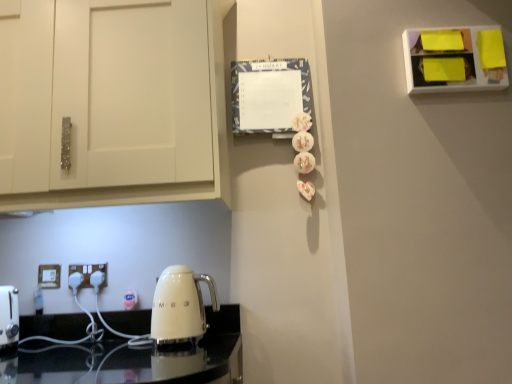
How much space does white plastic electric outlet at lower left, the 2th electric outlet in the left-to-right sequence, occupy horizontally?

2.17 centimeters.

Describe the element at coordinates (90, 273) in the screenshot. I see `white plastic electric outlet at lower left, placed as the 1th electric outlet when sorted from right to left` at that location.

Locate an element on the screen. This screenshot has width=512, height=384. white plastic electric outlet at lower left, placed as the 1th electric outlet when sorted from right to left is located at coordinates (90, 273).

What is the approximate width of white plastic electric outlet at lower left, the 2th electric outlet viewed from the right?

white plastic electric outlet at lower left, the 2th electric outlet viewed from the right, is 1.94 centimeters in width.

The width and height of the screenshot is (512, 384). What do you see at coordinates (49, 276) in the screenshot? I see `white plastic electric outlet at lower left, marked as the first electric outlet in a left-to-right arrangement` at bounding box center [49, 276].

Locate an element on the screen. This screenshot has width=512, height=384. white plastic electric outlet at lower left, marked as the first electric outlet in a left-to-right arrangement is located at coordinates (49, 276).

The height and width of the screenshot is (384, 512). Identify the location of white plastic electric outlet at lower left, placed as the 1th electric outlet when sorted from right to left. (90, 273).

Is white plastic electric outlet at lower left, placed as the 1th electric outlet when sorted from right to left, at the right side of white plastic electric outlet at lower left, the 2th electric outlet viewed from the right?

Indeed, white plastic electric outlet at lower left, placed as the 1th electric outlet when sorted from right to left, is positioned on the right side of white plastic electric outlet at lower left, the 2th electric outlet viewed from the right.

Is the depth of white plastic electric outlet at lower left, placed as the 1th electric outlet when sorted from right to left, less than that of white plastic electric outlet at lower left, marked as the first electric outlet in a left-to-right arrangement?

Yes, white plastic electric outlet at lower left, placed as the 1th electric outlet when sorted from right to left, is in front of white plastic electric outlet at lower left, marked as the first electric outlet in a left-to-right arrangement.

Which is less distant, (92, 265) or (56, 282)?

Point (92, 265) is farther from the camera than point (56, 282).

From the image's perspective, which one is positioned higher, white plastic electric outlet at lower left, placed as the 1th electric outlet when sorted from right to left, or white plastic electric outlet at lower left, the 2th electric outlet viewed from the right?

white plastic electric outlet at lower left, placed as the 1th electric outlet when sorted from right to left, from the image's perspective.

From a real-world perspective, who is located higher, white plastic electric outlet at lower left, placed as the 1th electric outlet when sorted from right to left, or white plastic electric outlet at lower left, marked as the first electric outlet in a left-to-right arrangement?

white plastic electric outlet at lower left, placed as the 1th electric outlet when sorted from right to left.

Looking at this image, considering the relative sizes of white plastic electric outlet at lower left, placed as the 1th electric outlet when sorted from right to left, and white plastic electric outlet at lower left, the 2th electric outlet viewed from the right, in the image provided, is white plastic electric outlet at lower left, placed as the 1th electric outlet when sorted from right to left, wider than white plastic electric outlet at lower left, the 2th electric outlet viewed from the right,?

Yes.

Who is taller, white plastic electric outlet at lower left, placed as the 1th electric outlet when sorted from right to left, or white plastic electric outlet at lower left, the 2th electric outlet viewed from the right?

Standing taller between the two is white plastic electric outlet at lower left, the 2th electric outlet viewed from the right.

Is white plastic electric outlet at lower left, the 2th electric outlet in the left-to-right sequence, bigger or smaller than white plastic electric outlet at lower left, marked as the first electric outlet in a left-to-right arrangement?

In the image, white plastic electric outlet at lower left, the 2th electric outlet in the left-to-right sequence, appears to be larger than white plastic electric outlet at lower left, marked as the first electric outlet in a left-to-right arrangement.

Would you say white plastic electric outlet at lower left, the 2th electric outlet in the left-to-right sequence, contains white plastic electric outlet at lower left, the 2th electric outlet viewed from the right?

No, white plastic electric outlet at lower left, the 2th electric outlet viewed from the right, is not inside white plastic electric outlet at lower left, the 2th electric outlet in the left-to-right sequence.

Are white plastic electric outlet at lower left, the 2th electric outlet in the left-to-right sequence, and white plastic electric outlet at lower left, marked as the first electric outlet in a left-to-right arrangement, located far from each other?

white plastic electric outlet at lower left, the 2th electric outlet in the left-to-right sequence, is near white plastic electric outlet at lower left, marked as the first electric outlet in a left-to-right arrangement, not far away.

Is white plastic electric outlet at lower left, the 2th electric outlet in the left-to-right sequence, aimed at white plastic electric outlet at lower left, marked as the first electric outlet in a left-to-right arrangement?

No.

Locate an element on the screen. electric outlet above the white plastic electric outlet at lower left, the 2th electric outlet viewed from the right (from the image's perspective) is located at coordinates (90, 273).

Is white plastic electric outlet at lower left, the 2th electric outlet viewed from the right, to the left of white plastic electric outlet at lower left, placed as the 1th electric outlet when sorted from right to left, from the viewer's perspective?

Result: Correct, you'll find white plastic electric outlet at lower left, the 2th electric outlet viewed from the right, to the left of white plastic electric outlet at lower left, placed as the 1th electric outlet when sorted from right to left.

Is white plastic electric outlet at lower left, the 2th electric outlet viewed from the right, positioned in front of white plastic electric outlet at lower left, placed as the 1th electric outlet when sorted from right to left?

No, it is not.

Between point (57, 279) and point (79, 265), which one is positioned in front?

The point (57, 279) is in front.

From the image's perspective, who appears lower, white plastic electric outlet at lower left, marked as the first electric outlet in a left-to-right arrangement, or white plastic electric outlet at lower left, placed as the 1th electric outlet when sorted from right to left?

white plastic electric outlet at lower left, marked as the first electric outlet in a left-to-right arrangement, from the image's perspective.

Consider the image. From a real-world perspective, relative to white plastic electric outlet at lower left, the 2th electric outlet in the left-to-right sequence, is white plastic electric outlet at lower left, the 2th electric outlet viewed from the right, vertically above or below?

white plastic electric outlet at lower left, the 2th electric outlet viewed from the right, is below white plastic electric outlet at lower left, the 2th electric outlet in the left-to-right sequence.

Between white plastic electric outlet at lower left, the 2th electric outlet viewed from the right, and white plastic electric outlet at lower left, the 2th electric outlet in the left-to-right sequence, which one has larger width?

white plastic electric outlet at lower left, the 2th electric outlet in the left-to-right sequence, is wider.

Can you confirm if white plastic electric outlet at lower left, marked as the first electric outlet in a left-to-right arrangement, is taller than white plastic electric outlet at lower left, the 2th electric outlet in the left-to-right sequence?

Correct, white plastic electric outlet at lower left, marked as the first electric outlet in a left-to-right arrangement, is much taller as white plastic electric outlet at lower left, the 2th electric outlet in the left-to-right sequence.

Considering the sizes of objects white plastic electric outlet at lower left, the 2th electric outlet viewed from the right, and white plastic electric outlet at lower left, the 2th electric outlet in the left-to-right sequence, in the image provided, who is smaller, white plastic electric outlet at lower left, the 2th electric outlet viewed from the right, or white plastic electric outlet at lower left, the 2th electric outlet in the left-to-right sequence,?

white plastic electric outlet at lower left, the 2th electric outlet viewed from the right.

Based on the photo, is white plastic electric outlet at lower left, marked as the first electric outlet in a left-to-right arrangement, not inside white plastic electric outlet at lower left, placed as the 1th electric outlet when sorted from right to left?

Yes, white plastic electric outlet at lower left, marked as the first electric outlet in a left-to-right arrangement, is not within white plastic electric outlet at lower left, placed as the 1th electric outlet when sorted from right to left.

Is white plastic electric outlet at lower left, the 2th electric outlet viewed from the right, next to white plastic electric outlet at lower left, placed as the 1th electric outlet when sorted from right to left, and touching it?

They are not placed beside each other.

Is white plastic electric outlet at lower left, marked as the first electric outlet in a left-to-right arrangement, aimed at white plastic electric outlet at lower left, placed as the 1th electric outlet when sorted from right to left?

No, white plastic electric outlet at lower left, marked as the first electric outlet in a left-to-right arrangement, does not turn towards white plastic electric outlet at lower left, placed as the 1th electric outlet when sorted from right to left.

Where is `electric outlet that appears behind the white plastic electric outlet at lower left, placed as the 1th electric outlet when sorted from right to left`? This screenshot has width=512, height=384. electric outlet that appears behind the white plastic electric outlet at lower left, placed as the 1th electric outlet when sorted from right to left is located at coordinates (49, 276).

At what (x,y) coordinates should I click in order to perform the action: click on electric outlet that is above the white plastic electric outlet at lower left, marked as the first electric outlet in a left-to-right arrangement (from the image's perspective). Please return your answer as a coordinate pair (x, y). This screenshot has width=512, height=384. Looking at the image, I should click on (90, 273).

In order to click on electric outlet that is under the white plastic electric outlet at lower left, placed as the 1th electric outlet when sorted from right to left (from a real-world perspective) in this screenshot , I will do `click(49, 276)`.